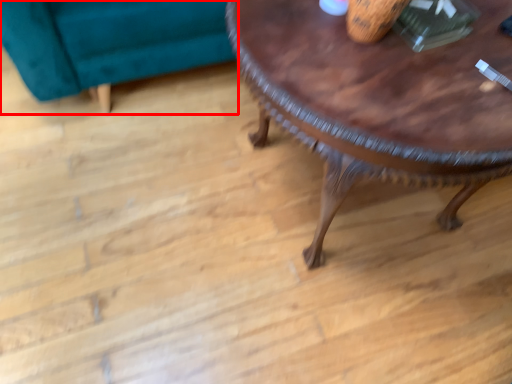
Question: Where is swivel chair (annotated by the red box) located in relation to coffee table in the image?

Choices:
 (A) left
 (B) right

Answer: (A)